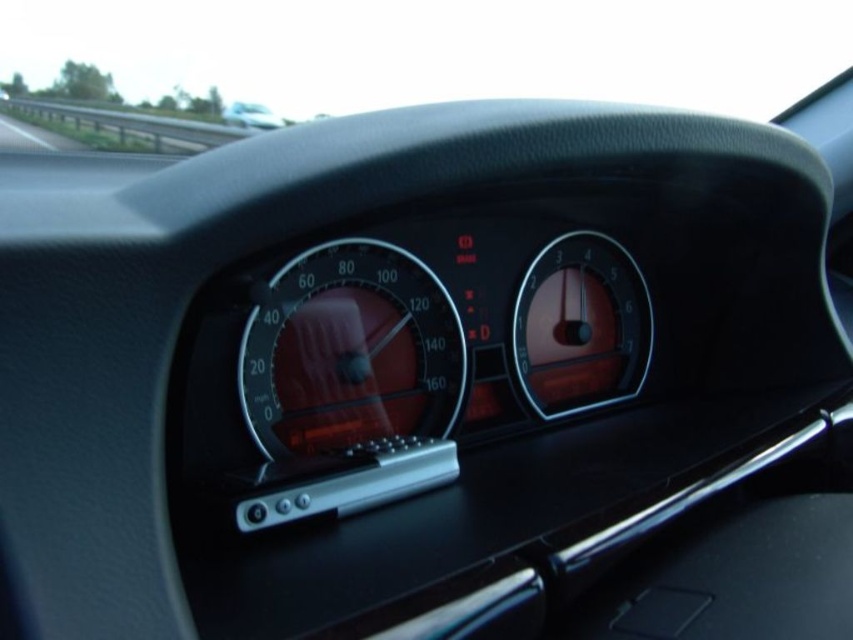
You are driving a car and notice two objects in your view. The metallic gray guardrail at upper left and the matte black dashboard at center. Which one appears bigger in your line of sight?

The metallic gray guardrail at upper left appears bigger in your line of sight because it is larger in size than the matte black dashboard at center.

You are a mechanic inspecting a car dashboard. You notice the glossy plastic speedometer at center and the matte black dashboard at center. Which object is positioned lower on the dashboard?

The glossy plastic speedometer at center is located below the matte black dashboard at center, so it is positioned lower on the dashboard.

You are a mechanic working on a car. You need to replace a part that is located between the matte black gauge at center and the matte black dashboard at center. The part requires a workspace of at least 8 feet. Do you think you have enough space to work?

The distance between the matte black gauge at center and the matte black dashboard at center is 7.67 feet. Since the required workspace is 8 feet, you do not have enough space to work.